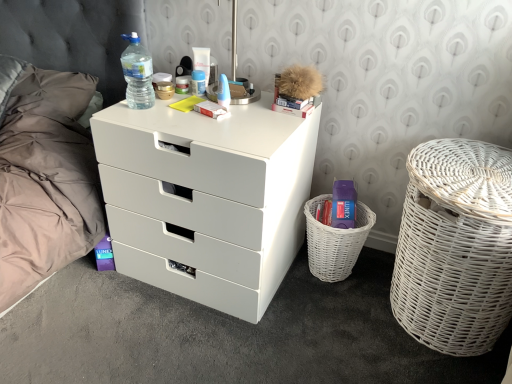
Where is `free spot to the left of white wicker basket at right`? The height and width of the screenshot is (384, 512). free spot to the left of white wicker basket at right is located at coordinates (327, 321).